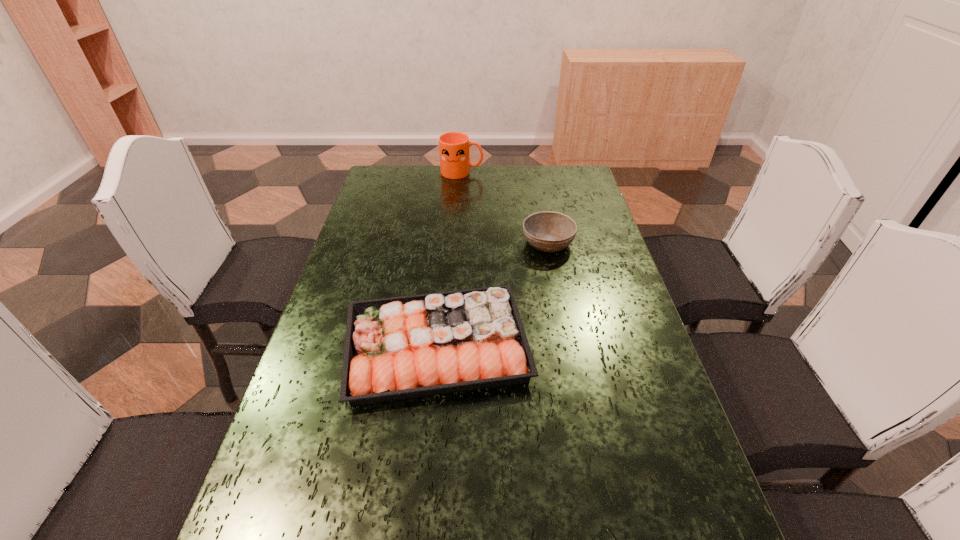
This screenshot has height=540, width=960. Identify the location of vacant space at the far edge of the desktop. (470, 185).

In the image, there is a desktop. Where is `vacant space at the left edge`? The width and height of the screenshot is (960, 540). vacant space at the left edge is located at coordinates (294, 444).

I want to click on vacant area at the right edge of the desktop, so click(x=583, y=280).

Find the location of a particular element. empty location between the mug and the third farthest object is located at coordinates (449, 259).

Locate an element on the screen. This screenshot has height=540, width=960. free spot between the third farthest object and the tallest object is located at coordinates (449, 259).

The height and width of the screenshot is (540, 960). Find the location of `free spot between the farthest object and the bowl`. free spot between the farthest object and the bowl is located at coordinates (505, 207).

Locate an element on the screen. This screenshot has width=960, height=540. free space between the third nearest object and the mug is located at coordinates (505, 207).

Point out which object is positioned as the second nearest to the sunglasses. Please provide its 2D coordinates. Your answer should be formatted as a tuple, i.e. [(x, y)], where the tuple contains the x and y coordinates of a point satisfying the conditions above.

[(547, 231)]

Locate an element on the screen. The width and height of the screenshot is (960, 540). object that stands as the closest to the platter is located at coordinates (547, 231).

Locate an element on the screen. The image size is (960, 540). blank space that satisfies the following two spatial constraints: 1. on the handle side of the farthest object; 2. on the front side of the platter is located at coordinates (450, 346).